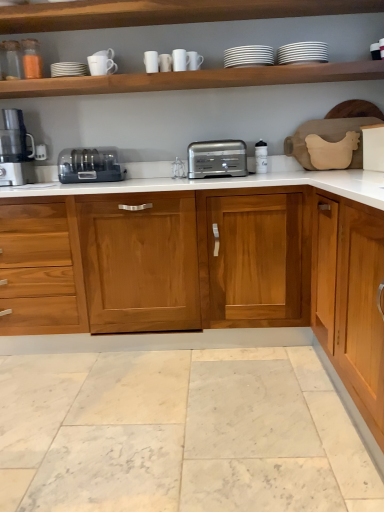
Question: From a real-world perspective, is satin silver toaster at center, the 2th toaster positioned from the left, above or below matte black coffee machine at left?

Choices:
 (A) above
 (B) below

Answer: (B)

Question: In terms of height, does satin silver toaster at center, the 2th toaster positioned from the left, look taller or shorter compared to matte black coffee machine at left?

Choices:
 (A) tall
 (B) short

Answer: (B)

Question: Based on their relative distances, which object is nearer to the white glossy plates at upper center, marked as the first tableware in a right-to-left arrangement?

Choices:
 (A) matte black coffee machine at left
 (B) wooden cabinet at center
 (C) wooden shelf at upper center, which is the first shelf from top to bottom
 (D) satin silver toaster at center, the first toaster in the left-to-right sequence
 (E) white matte wood shelf at upper center, the 2th shelf from the top

Answer: (E)

Question: Which object is the farthest from the wooden shelf at upper center, which is the first shelf from top to bottom?

Choices:
 (A) white matte wood shelf at upper center, the first shelf from the bottom
 (B) white ceramic mug at upper center, the sixth tableware from the right
 (C) satin silver toaster at center, the first toaster from the right
 (D) white matte cup at upper center, acting as the 2th tableware starting from the left
 (E) white glossy mug at upper center, acting as the 3th tableware starting from the left

Answer: (C)